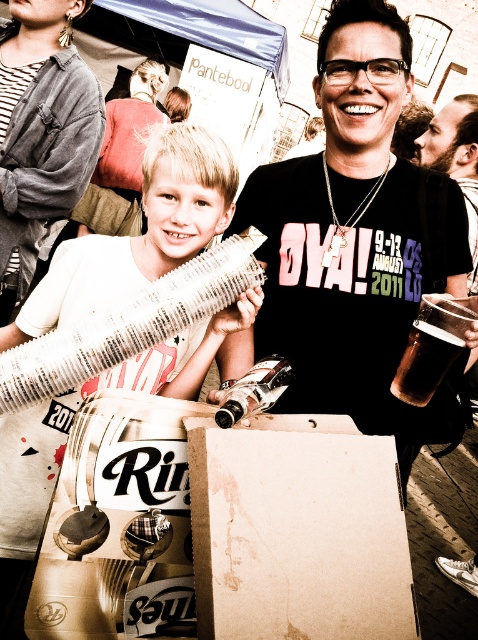
You are at a festival and need to choose between the white paper accordion at center and the brushed metal can at upper center to place a small sticker. Which object would you choose if you want the sticker to be more visible?

The white paper accordion at center is bigger than the brushed metal can at upper center, so the sticker would be more visible on the white paper accordion at center.

You are at a festival and need to place a new decoration between the white paper accordion at center and the brushed metal can at upper center. The decoration requires a space of 30 inches. Is there enough space between them?

The white paper accordion at center is 36.15 inches from the brushed metal can at upper center, so yes, there is enough space between them to place the decoration requiring 30 inches.